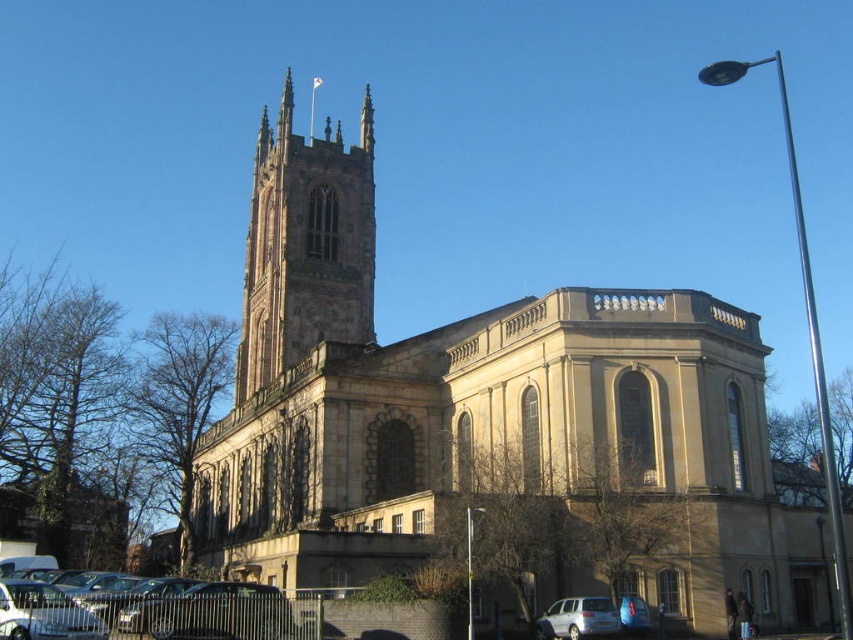
You are standing in front of the grand historic building shown in the image. There is a point marked at coordinates point (305, 244). What architectural feature does this point correspond to?

The point corresponds to the brown stone tower at center left.